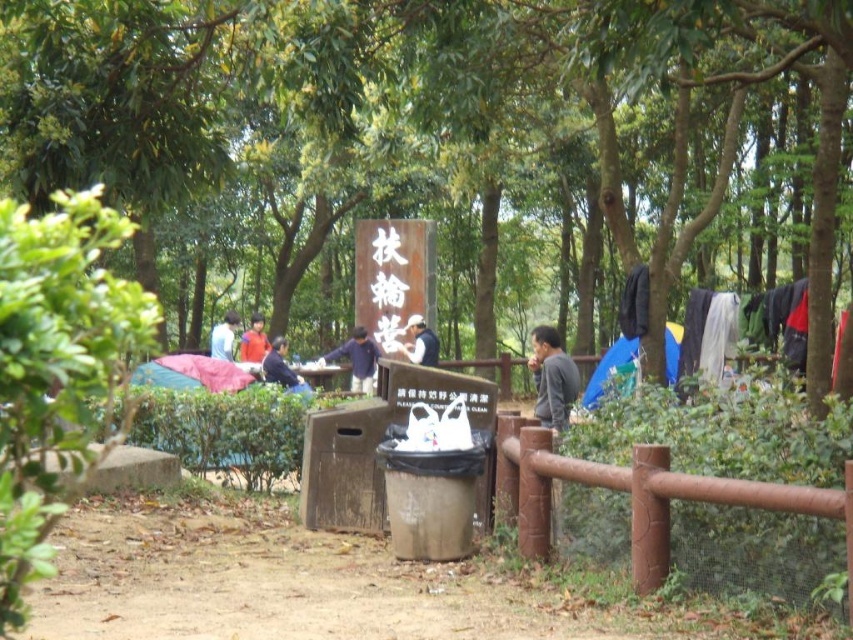
Which is behind, point (293, 374) or point (422, 337)?

Point (422, 337)

Does point (283, 384) come in front of point (415, 326)?

Yes, it is in front of point (415, 326).

The image size is (853, 640). Describe the element at coordinates (281, 369) in the screenshot. I see `dark blue shirt at center` at that location.

The height and width of the screenshot is (640, 853). I want to click on dark blue shirt at center, so click(281, 369).

Between dark blue jacket at center and light blue shirt at center, which one has less height?

light blue shirt at center is shorter.

Does dark blue jacket at center have a smaller size compared to light blue shirt at center?

No.

Which is in front, point (364, 333) or point (409, 326)?

Point (409, 326) is more forward.

Find the location of `dark blue jacket at center`. dark blue jacket at center is located at coordinates (357, 358).

Is point (560, 410) positioned before point (399, 346)?

Yes, it is in front of point (399, 346).

What do you see at coordinates (552, 378) in the screenshot? Image resolution: width=853 pixels, height=640 pixels. I see `gray matte jacket at center` at bounding box center [552, 378].

Who is more forward, (x=553, y=417) or (x=422, y=344)?

Positioned in front is point (x=553, y=417).

The image size is (853, 640). In order to click on gray matte jacket at center in this screenshot , I will do `click(552, 378)`.